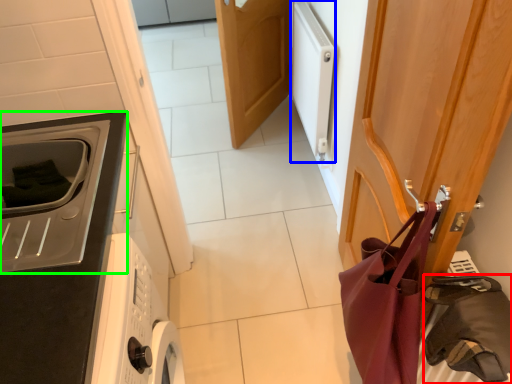
Question: Which object is positioned closest to bag (highlighted by a red box)? Select from appliance (highlighted by a blue box) and home appliance (highlighted by a green box).

Choices:
 (A) appliance
 (B) home appliance

Answer: (B)